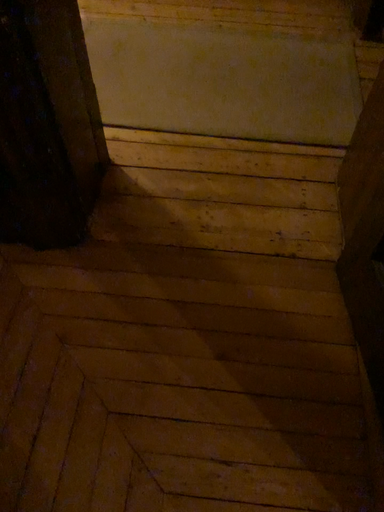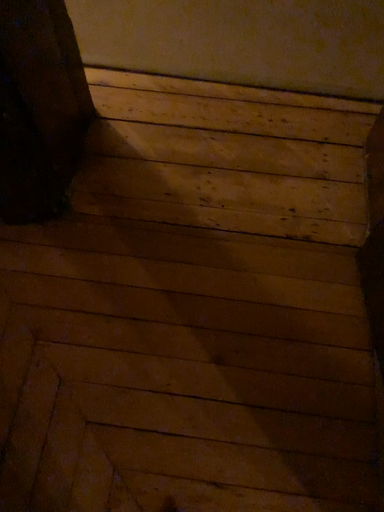
Question: Which way did the camera rotate in the video?

Choices:
 (A) rotated upward
 (B) rotated downward

Answer: (B)